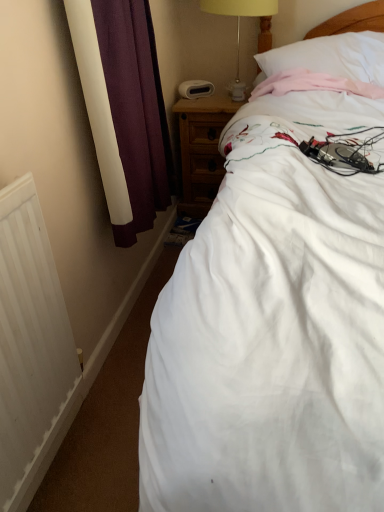
Locate an element on the screen. The height and width of the screenshot is (512, 384). yellow fabric lampshade at upper center is located at coordinates (239, 28).

What do you see at coordinates (30, 347) in the screenshot?
I see `white matte radiator at lower left` at bounding box center [30, 347].

What do you see at coordinates (330, 57) in the screenshot? I see `white soft pillow at upper right` at bounding box center [330, 57].

I want to click on yellow fabric lampshade at upper center, so click(239, 28).

Considering the sizes of objects wooden nightstand at upper right and yellow fabric lampshade at upper center in the image provided, who is shorter, wooden nightstand at upper right or yellow fabric lampshade at upper center?

Standing shorter between the two is yellow fabric lampshade at upper center.

Between wooden nightstand at upper right and yellow fabric lampshade at upper center, which one appears on the left side from the viewer's perspective?

wooden nightstand at upper right is more to the left.

Considering the sizes of objects wooden nightstand at upper right and yellow fabric lampshade at upper center in the image provided, who is bigger, wooden nightstand at upper right or yellow fabric lampshade at upper center?

Bigger between the two is wooden nightstand at upper right.

Is white soft pillow at upper right at the left side of white cotton bed at center?

In fact, white soft pillow at upper right is to the right of white cotton bed at center.

Considering the sizes of objects white soft pillow at upper right and white cotton bed at center in the image provided, who is taller, white soft pillow at upper right or white cotton bed at center?

white cotton bed at center.

Is white soft pillow at upper right touching white cotton bed at center?

No, white soft pillow at upper right is not in contact with white cotton bed at center.

From a real-world perspective, which is physically below, yellow fabric lampshade at upper center or white soft pillow at upper right?

white soft pillow at upper right is physically lower.

How much distance is there between yellow fabric lampshade at upper center and white soft pillow at upper right?

yellow fabric lampshade at upper center and white soft pillow at upper right are 17.44 inches apart.

Can you confirm if yellow fabric lampshade at upper center is shorter than white soft pillow at upper right?

No.

Visually, is yellow fabric lampshade at upper center positioned to the left or to the right of white soft pillow at upper right?

yellow fabric lampshade at upper center is to the left of white soft pillow at upper right.

From a real-world perspective, is white soft pillow at upper right positioned above or below white matte radiator at lower left?

In terms of real-world spatial position, white soft pillow at upper right is above white matte radiator at lower left.

Is white soft pillow at upper right bigger than white matte radiator at lower left?

Correct, white soft pillow at upper right is larger in size than white matte radiator at lower left.

Would you say white soft pillow at upper right contains white matte radiator at lower left?

No.

How many degrees apart are the facing directions of white soft pillow at upper right and white matte radiator at lower left?

They differ by 78.2 degrees in their facing directions.

Visually, is wooden nightstand at upper right positioned to the left or to the right of white cotton bed at center?

Clearly, wooden nightstand at upper right is on the left of white cotton bed at center in the image.

Is wooden nightstand at upper right wider or thinner than white cotton bed at center?

Clearly, wooden nightstand at upper right has less width compared to white cotton bed at center.

Is wooden nightstand at upper right situated inside white cotton bed at center or outside?

wooden nightstand at upper right cannot be found inside white cotton bed at center.

Between white soft pillow at upper right and wooden nightstand at upper right, which one has larger width?

white soft pillow at upper right is wider.

Can you tell me how much white soft pillow at upper right and wooden nightstand at upper right differ in facing direction?

They differ by 12.1 degrees in their facing directions.

Does white soft pillow at upper right appear on the left side of wooden nightstand at upper right?

No.

Considering the relative positions of white soft pillow at upper right and wooden nightstand at upper right in the image provided, is white soft pillow at upper right in front of wooden nightstand at upper right?

Yes, white soft pillow at upper right is closer to the camera.

From the image's perspective, which is below, white cotton bed at center or white matte radiator at lower left?

white matte radiator at lower left, from the image's perspective.

Considering the relative sizes of white cotton bed at center and white matte radiator at lower left in the image provided, is white cotton bed at center wider than white matte radiator at lower left?

Yes, white cotton bed at center is wider than white matte radiator at lower left.

Identify the location of radiator below the white cotton bed at center (from the image's perspective). (30, 347).

Is white cotton bed at center positioned in front of white matte radiator at lower left?

That is True.

Find the location of a particular element. The image size is (384, 512). table lamp on the right side of wooden nightstand at upper right is located at coordinates (239, 28).

The image size is (384, 512). Identify the location of pillow lying above the white cotton bed at center (from the image's perspective). (330, 57).

When comparing their distances from white soft pillow at upper right, does wooden nightstand at upper right or white cotton bed at center seem further?

Based on the image, white cotton bed at center appears to be further to white soft pillow at upper right.

Estimate the real-world distances between objects in this image. Which object is closer to white cotton bed at center, yellow fabric lampshade at upper center or white matte radiator at lower left?

white matte radiator at lower left is closer to white cotton bed at center.

Looking at this image, when comparing their distances from wooden nightstand at upper right, does white cotton bed at center or white soft pillow at upper right seem further?

white cotton bed at center is further to wooden nightstand at upper right.

Estimate the real-world distances between objects in this image. Which object is closer to white matte radiator at lower left, white cotton bed at center or yellow fabric lampshade at upper center?

white cotton bed at center.

When comparing their distances from wooden nightstand at upper right, does yellow fabric lampshade at upper center or white matte radiator at lower left seem closer?

yellow fabric lampshade at upper center.

Which object lies further to the anchor point white matte radiator at lower left, white soft pillow at upper right or wooden nightstand at upper right?

Among the two, white soft pillow at upper right is located further to white matte radiator at lower left.

Estimate the real-world distances between objects in this image. Which object is closer to white soft pillow at upper right, white cotton bed at center or wooden nightstand at upper right?

wooden nightstand at upper right is positioned closer to the anchor white soft pillow at upper right.

Estimate the real-world distances between objects in this image. Which object is further from yellow fabric lampshade at upper center, white matte radiator at lower left or wooden nightstand at upper right?

white matte radiator at lower left.

I want to click on pillow between white cotton bed at center and wooden nightstand at upper right from front to back, so click(330, 57).

In order to click on radiator located between white cotton bed at center and wooden nightstand at upper right in the depth direction in this screenshot , I will do (30, 347).

You are a GUI agent. You are given a task and a screenshot of the screen. Output one action in this format:
    pyautogui.click(x=<x>, y=<y>)
    Task: Click on the table lamp between white matte radiator at lower left and wooden nightstand at upper right along the z-axis
    Image resolution: width=384 pixels, height=512 pixels.
    Given the screenshot: What is the action you would take?
    pyautogui.click(x=239, y=28)

Locate an element on the screen. table lamp between wooden nightstand at upper right and white soft pillow at upper right is located at coordinates (239, 28).